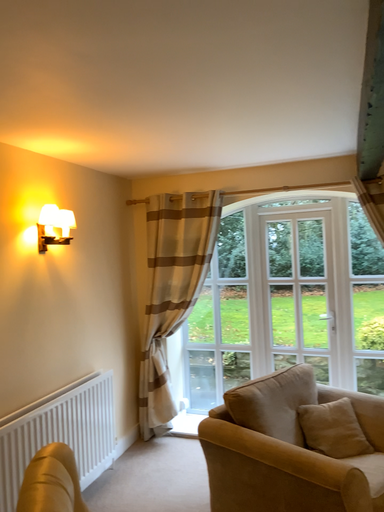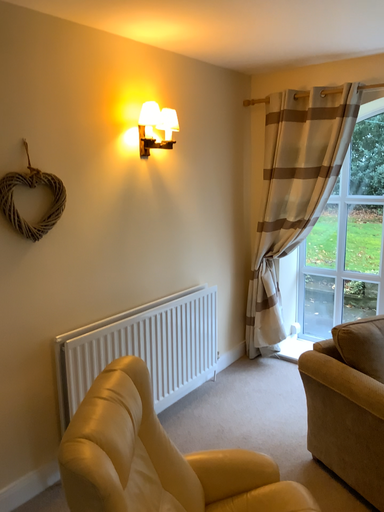
Question: How did the camera likely rotate when shooting the video?

Choices:
 (A) rotated upward
 (B) rotated downward

Answer: (B)